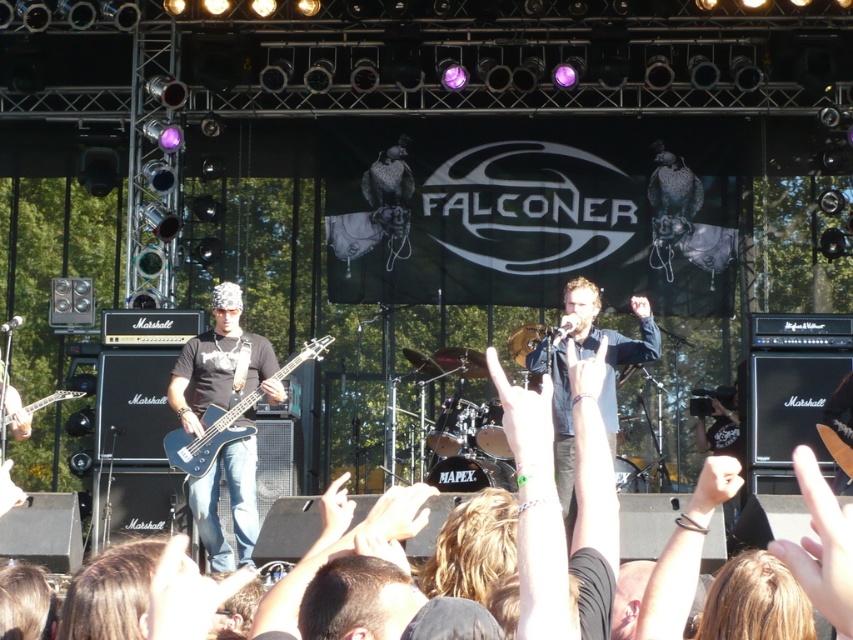
Can you confirm if matte black guitar at left is thinner than glossy black electric guitar at left?

Yes, matte black guitar at left is thinner than glossy black electric guitar at left.

Is matte black guitar at left wider than glossy black electric guitar at left?

No, matte black guitar at left is not wider than glossy black electric guitar at left.

The height and width of the screenshot is (640, 853). Identify the location of matte black guitar at left. (219, 364).

Does matte black guitar at left lie in front of denim shorts at center?

No, matte black guitar at left is further to the viewer.

In the scene shown: Can you confirm if matte black guitar at left is positioned to the right of denim shorts at center?

In fact, matte black guitar at left is to the left of denim shorts at center.

Locate an element on the screen. matte black guitar at left is located at coordinates (219, 364).

Who is positioned more to the left, denim shorts at center or glossy black electric guitar at left?

Positioned to the left is glossy black electric guitar at left.

Is denim shorts at center shorter than glossy black electric guitar at left?

Incorrect, denim shorts at center's height does not fall short of glossy black electric guitar at left's.

Image resolution: width=853 pixels, height=640 pixels. Find the location of `denim shorts at center`. denim shorts at center is located at coordinates (584, 356).